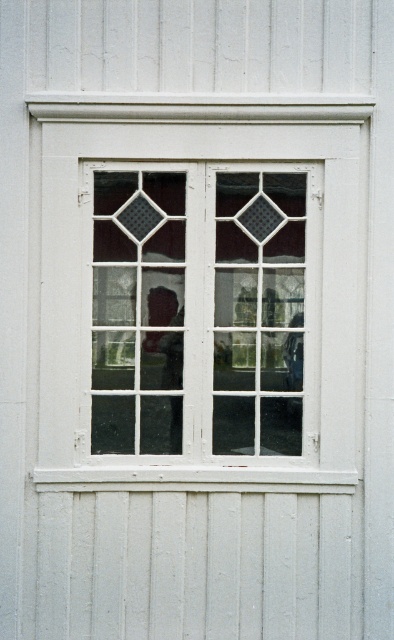
Question: Which point is closer to the camera?

Choices:
 (A) white wood window at center
 (B) clear glass window at center

Answer: (A)

Question: Is white wood window at center above clear glass window at center?

Choices:
 (A) yes
 (B) no

Answer: (A)

Question: Does white wood window at center have a greater width compared to clear glass window at center?

Choices:
 (A) no
 (B) yes

Answer: (B)

Question: Which point appears farthest from the camera in this image?

Choices:
 (A) (107, 273)
 (B) (195, 348)

Answer: (A)

Question: Does white wood window at center have a lesser width compared to clear glass window at center?

Choices:
 (A) yes
 (B) no

Answer: (B)

Question: Which object appears farthest from the camera in this image?

Choices:
 (A) white wood window at center
 (B) clear glass window at center

Answer: (B)